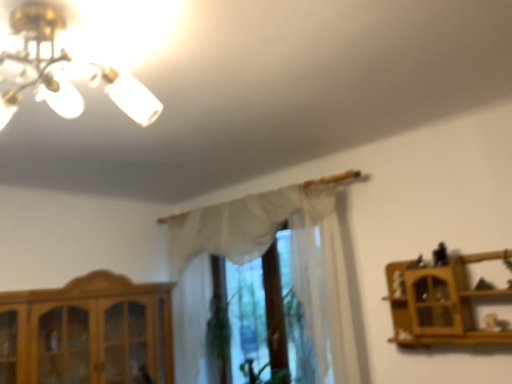
Question: Is black plastic toy at upper right oriented away from white sheer curtain at center?

Choices:
 (A) yes
 (B) no

Answer: (B)

Question: From a real-world perspective, does black plastic toy at upper right sit lower than white sheer curtain at center?

Choices:
 (A) yes
 (B) no

Answer: (A)

Question: Is black plastic toy at upper right to the right of white sheer curtain at center from the viewer's perspective?

Choices:
 (A) no
 (B) yes

Answer: (B)

Question: Is black plastic toy at upper right oriented towards white sheer curtain at center?

Choices:
 (A) no
 (B) yes

Answer: (A)

Question: Considering the relative sizes of black plastic toy at upper right and white sheer curtain at center in the image provided, is black plastic toy at upper right bigger than white sheer curtain at center?

Choices:
 (A) yes
 (B) no

Answer: (B)

Question: Is black plastic toy at upper right smaller than white sheer curtain at center?

Choices:
 (A) yes
 (B) no

Answer: (A)

Question: Is white sheer curtain at center facing towards black plastic toy at upper right?

Choices:
 (A) yes
 (B) no

Answer: (B)

Question: From a real-world perspective, is white sheer curtain at center located beneath black plastic toy at upper right?

Choices:
 (A) no
 (B) yes

Answer: (A)

Question: From the image's perspective, does white sheer curtain at center appear higher than black plastic toy at upper right?

Choices:
 (A) yes
 (B) no

Answer: (B)

Question: Would you say white sheer curtain at center is a long distance from black plastic toy at upper right?

Choices:
 (A) no
 (B) yes

Answer: (B)

Question: Is white sheer curtain at center to the left of black plastic toy at upper right from the viewer's perspective?

Choices:
 (A) no
 (B) yes

Answer: (B)

Question: Can you confirm if white sheer curtain at center is positioned to the right of black plastic toy at upper right?

Choices:
 (A) yes
 (B) no

Answer: (B)

Question: Does wooden cabinet at lower left appear on the left side of white sheer curtain at center?

Choices:
 (A) yes
 (B) no

Answer: (A)